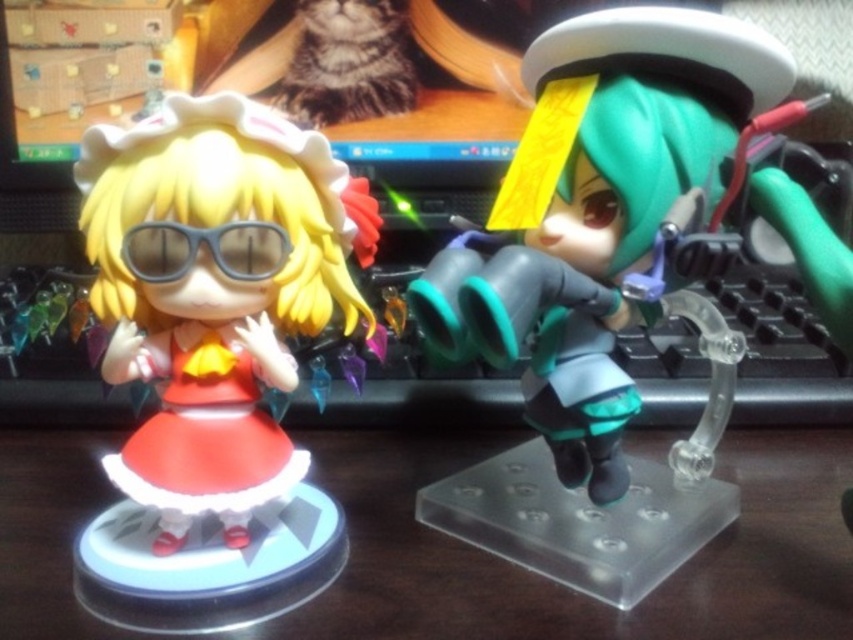
You are setting up a display on a narrow shelf that can only accommodate items up to 10 cm in width. You have the matte black figurine at left and the matte black goggles at left. Based on their sizes, which item can fit within the shelf width limit?

The matte black goggles at left can fit within the shelf width limit since the matte black figurine at left is wider than the goggles.

You are organizing a desk and want to place a new object between the wooden table at center and the matte black figurine at left. Is there enough space between them for a 10 cm wide object?

The matte black figurine at left is behind the wooden table at center, so there is no space between them for a 10 cm wide object.